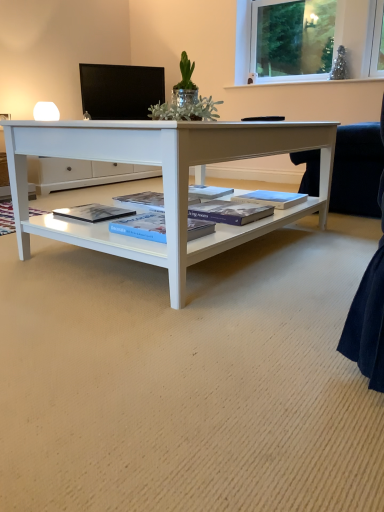
Question: Would you say blue glossy book at center, which appears as the 3th magazine when viewed from the right, is to the left or to the right of blue matte book at center, which is counted as the third magazine, starting from the left, in the picture?

Choices:
 (A) left
 (B) right

Answer: (A)

Question: In terms of size, does blue glossy book at center, which ranks as the 2th magazine in left-to-right order, appear bigger or smaller than blue matte book at center, which is counted as the third magazine, starting from the left?

Choices:
 (A) big
 (B) small

Answer: (A)

Question: Which object is the closest to the black glossy monitor at upper center?

Choices:
 (A) matte blue magazine at center, which ranks as the first magazine in right-to-left order
 (B) blue glossy book at center, which appears as the 3th magazine when viewed from the right
 (C) blue matte book at center, which is counted as the third magazine, starting from the left
 (D) clear glass window at upper right
 (E) matte black book at center, which is the 4th magazine in right-to-left order

Answer: (A)

Question: Estimate the real-world distances between objects in this image. Which object is closer to the blue glossy book at center, which ranks as the 2th magazine in left-to-right order?

Choices:
 (A) matte blue magazine at center, which ranks as the 4th magazine in left-to-right order
 (B) black glossy monitor at upper center
 (C) matte black book at center, which is the 1th magazine in left-to-right order
 (D) blue matte book at center, which is counted as the third magazine, starting from the left
 (E) clear glass window at upper right

Answer: (C)